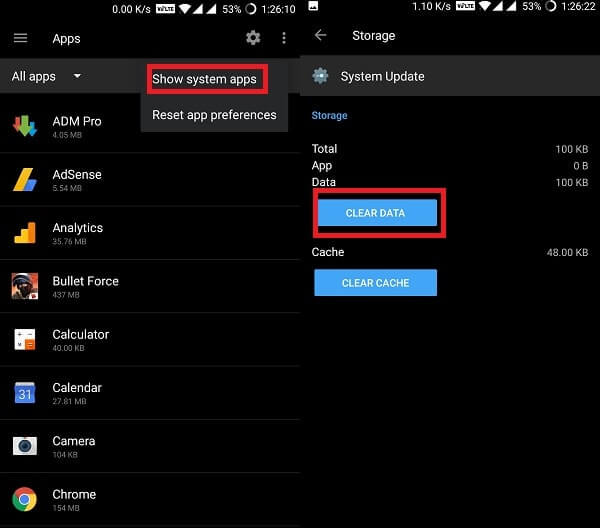
Locate an element on the screen. The height and width of the screenshot is (528, 600). calculator is located at coordinates (26, 341).